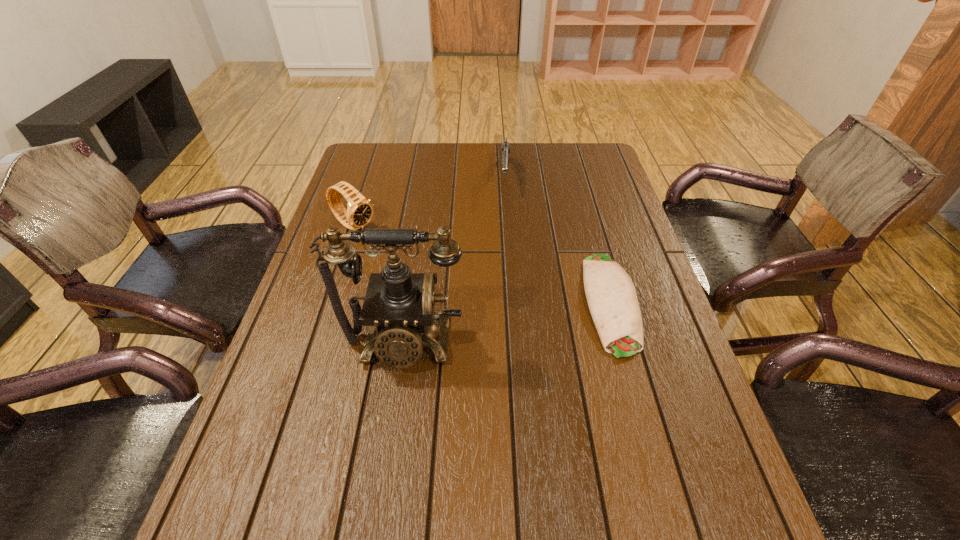
The width and height of the screenshot is (960, 540). What are the coordinates of `telephone` in the screenshot? It's located at (398, 306).

The width and height of the screenshot is (960, 540). I want to click on the rightmost object, so (x=612, y=299).

Identify the location of the shortest object. (612, 299).

The height and width of the screenshot is (540, 960). I want to click on watch, so click(359, 212).

Locate an element on the screen. the third nearest object is located at coordinates (359, 212).

At what (x,y) coordinates should I click in order to perform the action: click on gun. Please return your answer as a coordinate pair (x, y). The height and width of the screenshot is (540, 960). Looking at the image, I should click on (505, 151).

Find the location of a particular element. the second shortest object is located at coordinates (505, 151).

This screenshot has height=540, width=960. In order to click on free region located 0.160m on the rotary dial of the tallest object in this screenshot , I will do `click(386, 454)`.

Identify the location of vacant space situated at the bitten end of the rightmost object. (647, 434).

This screenshot has height=540, width=960. Find the location of `free space located 0.330m on the face of the watch`. free space located 0.330m on the face of the watch is located at coordinates (455, 287).